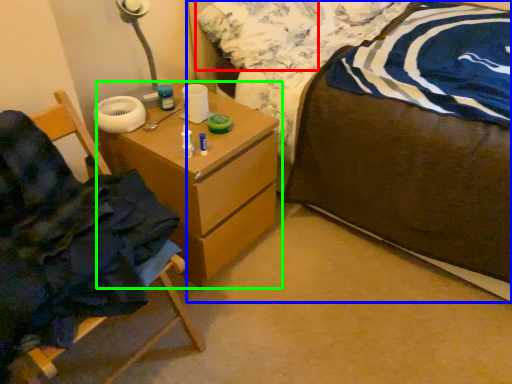
Question: Which object is the farthest from pillow (highlighted by a red box)? Choose among these: bed (highlighted by a blue box) or chest of drawers (highlighted by a green box).

Choices:
 (A) bed
 (B) chest of drawers

Answer: (B)